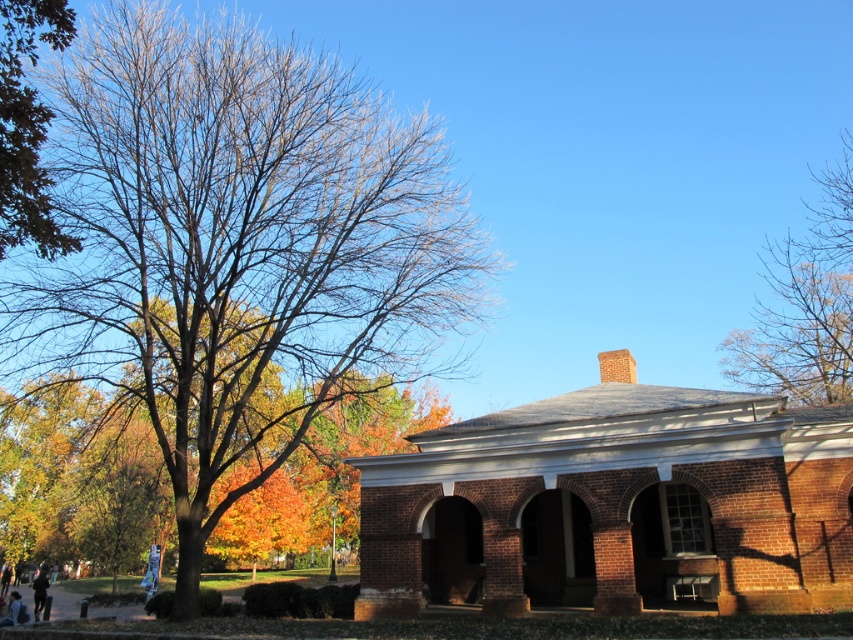
Does black fabric person at lower left lie in front of blue denim jeans at lower left?

No, it is not.

Can you confirm if black fabric person at lower left is taller than blue denim jeans at lower left?

Correct, black fabric person at lower left is much taller as blue denim jeans at lower left.

The height and width of the screenshot is (640, 853). I want to click on black fabric person at lower left, so (x=39, y=589).

I want to click on black fabric person at lower left, so click(39, 589).

Is bare branches at left bigger than blue denim jeans at lower left?

Yes.

Can you confirm if bare branches at left is shorter than blue denim jeans at lower left?

No.

What do you see at coordinates (235, 248) in the screenshot? I see `bare branches at left` at bounding box center [235, 248].

Find the location of a particular element. The width and height of the screenshot is (853, 640). bare branches at left is located at coordinates (235, 248).

Is bare branches at upper right to the left of black fabric person at lower left from the viewer's perspective?

Incorrect, bare branches at upper right is not on the left side of black fabric person at lower left.

Who is higher up, bare branches at upper right or black fabric person at lower left?

Positioned higher is bare branches at upper right.

This screenshot has width=853, height=640. What are the coordinates of `bare branches at upper right` in the screenshot? It's located at (805, 305).

This screenshot has width=853, height=640. What are the coordinates of `bare branches at upper right` in the screenshot? It's located at (805, 305).